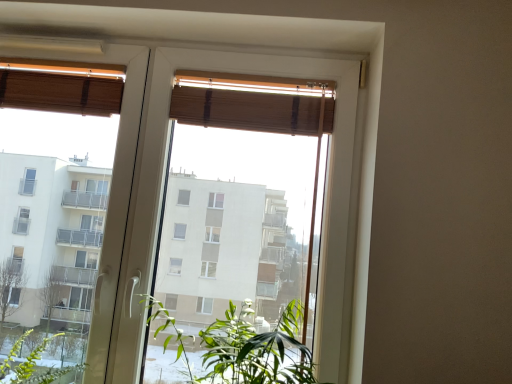
Question: From a real-world perspective, is wooden blind at upper center, which is the 2th curtain in left-to-right order, positioned above or below wooden blinds at upper center?

Choices:
 (A) below
 (B) above

Answer: (B)

Question: Based on their sizes in the image, would you say wooden blind at upper center, which is the 1th curtain from right to left, is bigger or smaller than wooden blinds at upper center?

Choices:
 (A) big
 (B) small

Answer: (B)

Question: Which object is the closest to the wooden blind at upper left, which ranks as the 2th curtain in right-to-left order?

Choices:
 (A) wooden blind at upper center, which is the 2th curtain in left-to-right order
 (B) green leafy plant at center
 (C) wooden blinds at upper center

Answer: (C)

Question: Which is farther from the wooden blind at upper center, which is the 1th curtain from right to left?

Choices:
 (A) wooden blinds at upper center
 (B) green leafy plant at center
 (C) wooden blind at upper left, which ranks as the 2th curtain in right-to-left order

Answer: (B)